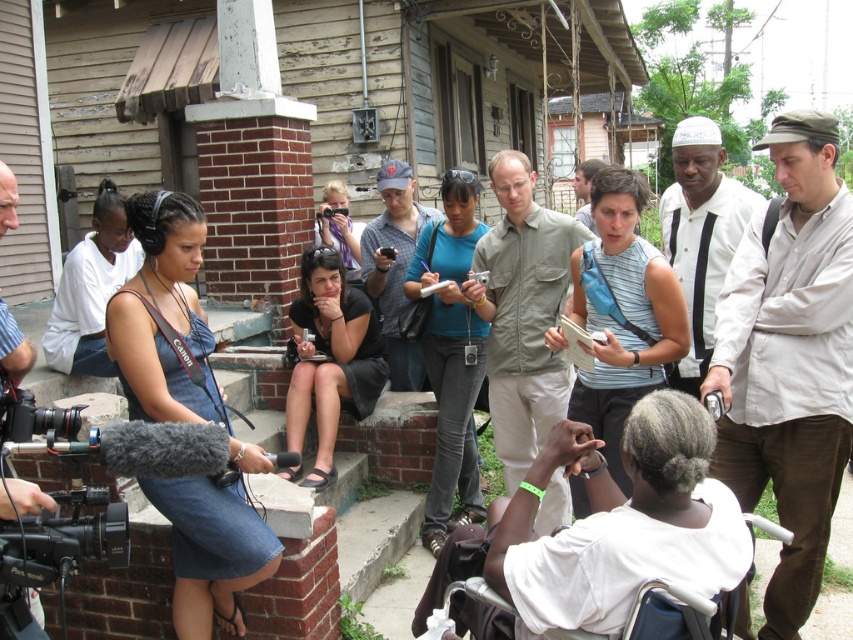
From the picture: You are a photographer at the scene and want to capture both the black fabric skirt at center and the striped cotton shirt at left in the same frame. Which object should you focus on first to ensure both are in the frame?

You should focus on the black fabric skirt at center first because its width is larger than the striped cotton shirt at left, so centering it will help include both in the frame.